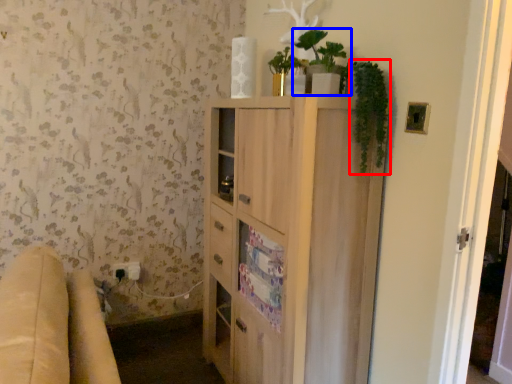
Question: Which object is closer to the camera taking this photo, plant (highlighted by a red box) or houseplant (highlighted by a blue box)?

Choices:
 (A) plant
 (B) houseplant

Answer: (A)